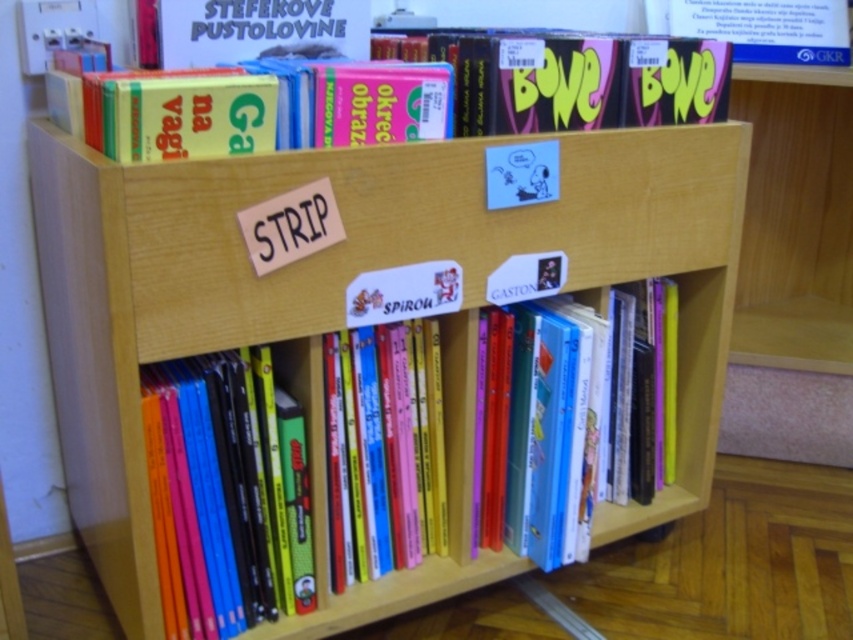
Question: Does matte plastic book at upper center appear under hardcover comic book at center?

Choices:
 (A) no
 (B) yes

Answer: (A)

Question: Is hardcover comic books at lower left to the left of matte plastic book at upper center from the viewer's perspective?

Choices:
 (A) yes
 (B) no

Answer: (A)

Question: In this image, where is matte plastic book at upper center located relative to hardcover book at center?

Choices:
 (A) right
 (B) left

Answer: (B)

Question: Estimate the real-world distances between objects in this image. Which object is farther from the matte plastic book at upper center?

Choices:
 (A) hardcover comic books at lower left
 (B) hardcover comic book at center
 (C) wooden bookshelf at center

Answer: (A)

Question: Which point is closer to the camera?

Choices:
 (A) wooden bookshelf at center
 (B) hardcover comic book at center

Answer: (A)

Question: Which point appears farthest from the camera in this image?

Choices:
 (A) (753, 33)
 (B) (421, 468)
 (C) (548, 541)
 (D) (256, 365)

Answer: (A)